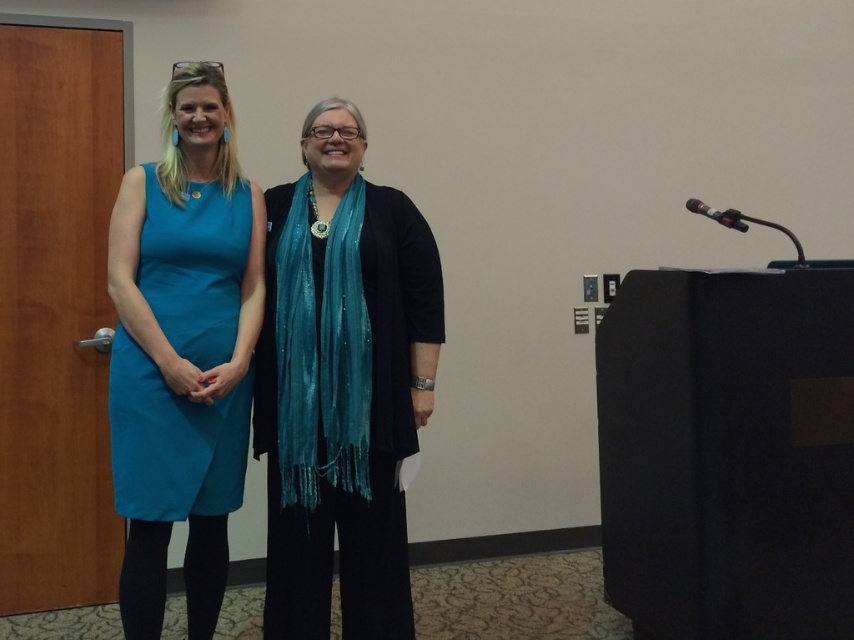
Can you confirm if shiny teal scarf at center is shorter than teal fabric dress at left?

Incorrect, shiny teal scarf at center's height does not fall short of teal fabric dress at left's.

Is point (313, 532) positioned in front of point (199, 221)?

No, it is behind (199, 221).

At what (x,y) coordinates should I click in order to perform the action: click on shiny teal scarf at center. Please return your answer as a coordinate pair (x, y). Image resolution: width=854 pixels, height=640 pixels. Looking at the image, I should click on (341, 385).

Can you confirm if shiny teal scarf at center is positioned above teal shimmering scarf at center?

No, shiny teal scarf at center is not above teal shimmering scarf at center.

Which is more to the left, shiny teal scarf at center or teal shimmering scarf at center?

teal shimmering scarf at center

Image resolution: width=854 pixels, height=640 pixels. I want to click on shiny teal scarf at center, so click(x=341, y=385).

Does teal fabric dress at left appear on the left side of teal shimmering scarf at center?

Yes, teal fabric dress at left is to the left of teal shimmering scarf at center.

Can you confirm if teal fabric dress at left is bigger than teal shimmering scarf at center?

Yes, teal fabric dress at left is bigger than teal shimmering scarf at center.

I want to click on teal fabric dress at left, so click(173, 442).